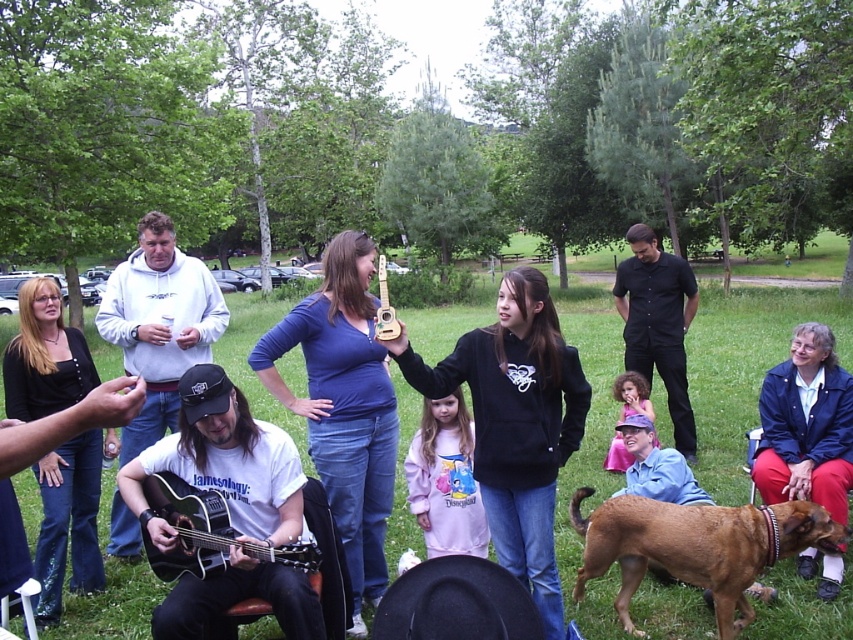
You are organizing a music event and need to place two guitars on a shelf that can only hold items up to 40 cm in width. You have the black matte guitar at center and the acoustic guitar at lower left. Which guitar is more likely to exceed the shelf width limit?

The black matte guitar at center is more likely to exceed the shelf width limit because its width is larger than the acoustic guitar at lower left.

You are standing in the park and see two points marked in the image. Which point is closer to you, point (196, 376) or point (207, 534)?

Point (196, 376) is closer to you because it is further to the viewer than point (207, 534).